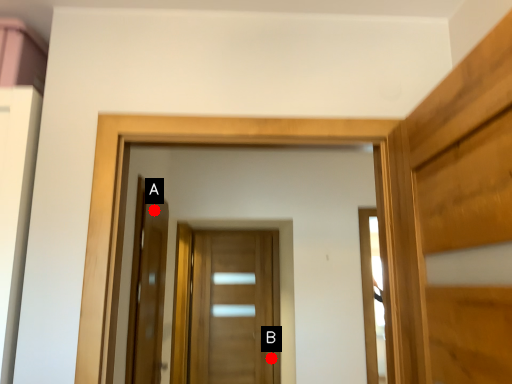
Question: Two points are circled on the image, labeled by A and B beside each circle. Which point is closer to the camera taking this photo?

Choices:
 (A) A is closer
 (B) B is closer

Answer: (A)